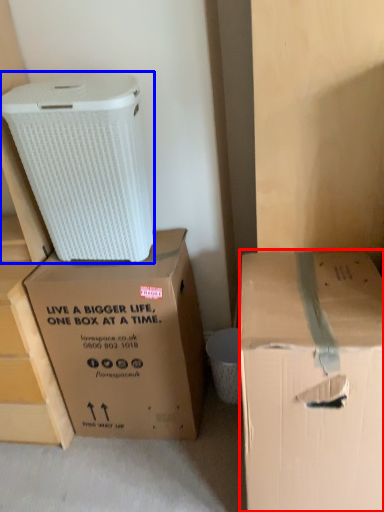
Question: Which object is further to the camera taking this photo, box (highlighted by a red box) or cardboard box (highlighted by a blue box)?

Choices:
 (A) box
 (B) cardboard box

Answer: (B)